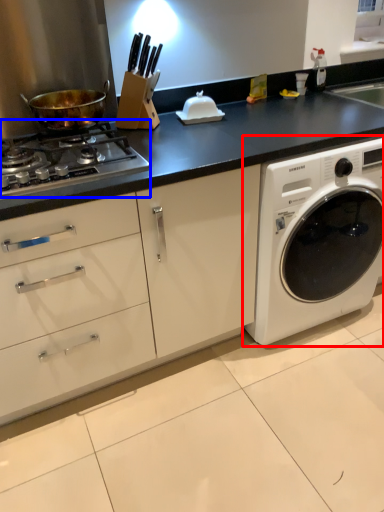
Question: Which object appears farthest to the camera in this image, washing machine (highlighted by a red box) or gas stove (highlighted by a blue box)?

Choices:
 (A) washing machine
 (B) gas stove

Answer: (A)